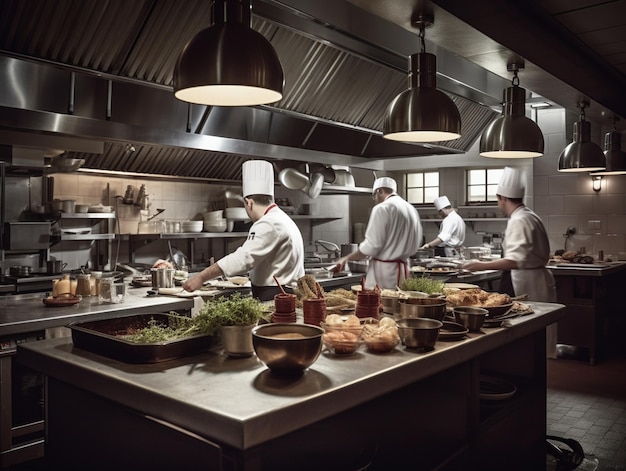
Identify the location of windows. This screenshot has width=626, height=471. [x=485, y=181], [x=428, y=184].